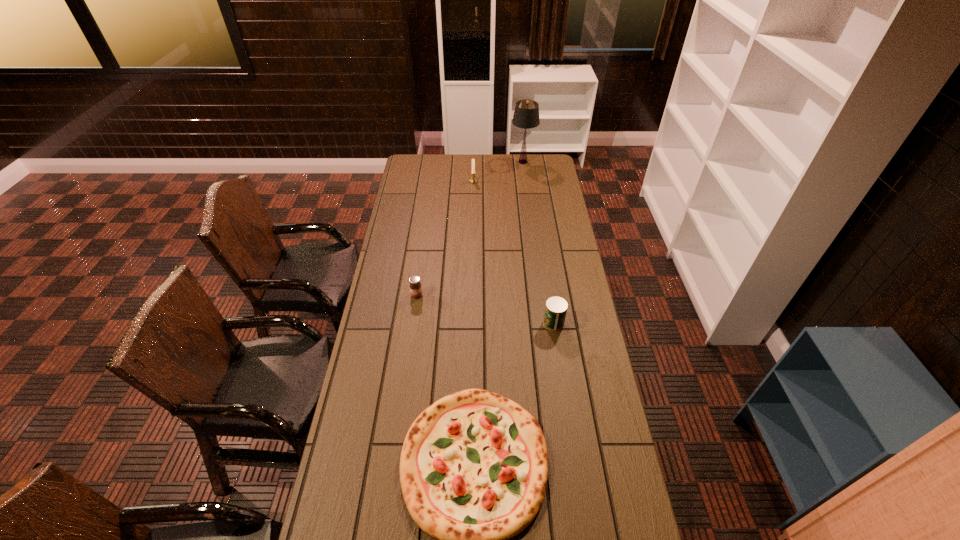
You are a GUI agent. You are given a task and a screenshot of the screen. Output one action in this format:
    pyautogui.click(x=<x>, y=<y>)
    Task: Click on the free space at the right edge
    
    Given the screenshot: What is the action you would take?
    pyautogui.click(x=537, y=178)

You are a GUI agent. You are given a task and a screenshot of the screen. Output one action in this format:
    pyautogui.click(x=<x>, y=<y>)
    Task: Click on the vacant region at the far left corner of the desktop
    
    Given the screenshot: What is the action you would take?
    pyautogui.click(x=411, y=157)

Locate an element on the screen. The width and height of the screenshot is (960, 540). vacant space at the far right corner of the desktop is located at coordinates (539, 173).

The width and height of the screenshot is (960, 540). In order to click on vacant area that lies between the farthest object and the jam in this screenshot , I will do 469,228.

At what (x,y) coordinates should I click in order to perform the action: click on free area in between the farthest object and the fourth farthest object. Please return your answer as a coordinate pair (x, y). The height and width of the screenshot is (540, 960). Looking at the image, I should click on (x=539, y=242).

This screenshot has height=540, width=960. Find the location of `vacant space that is in between the candle holder and the jam`. vacant space that is in between the candle holder and the jam is located at coordinates [x=445, y=238].

The width and height of the screenshot is (960, 540). Find the location of `free spot between the fourth shortest object and the can`. free spot between the fourth shortest object and the can is located at coordinates (514, 252).

Find the location of `vacant area that lies between the second tallest object and the can`. vacant area that lies between the second tallest object and the can is located at coordinates (514, 252).

Identify the location of free area in between the fourth nearest object and the jam. The height and width of the screenshot is (540, 960). click(445, 238).

Identify which object is the fourth nearest to the second tallest object. Please provide its 2D coordinates. Your answer should be formatted as a tuple, i.e. [(x, y)], where the tuple contains the x and y coordinates of a point satisfying the conditions above.

[(473, 469)]